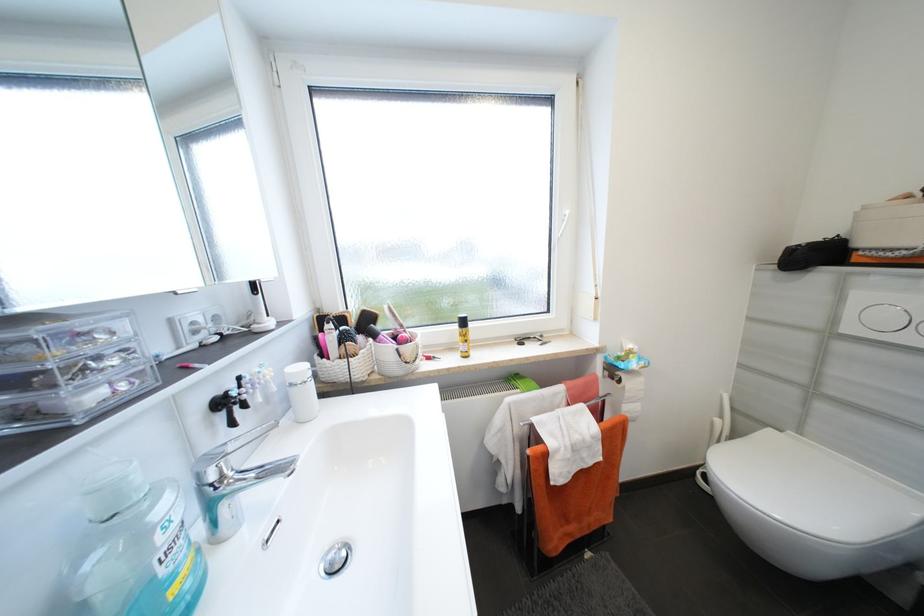
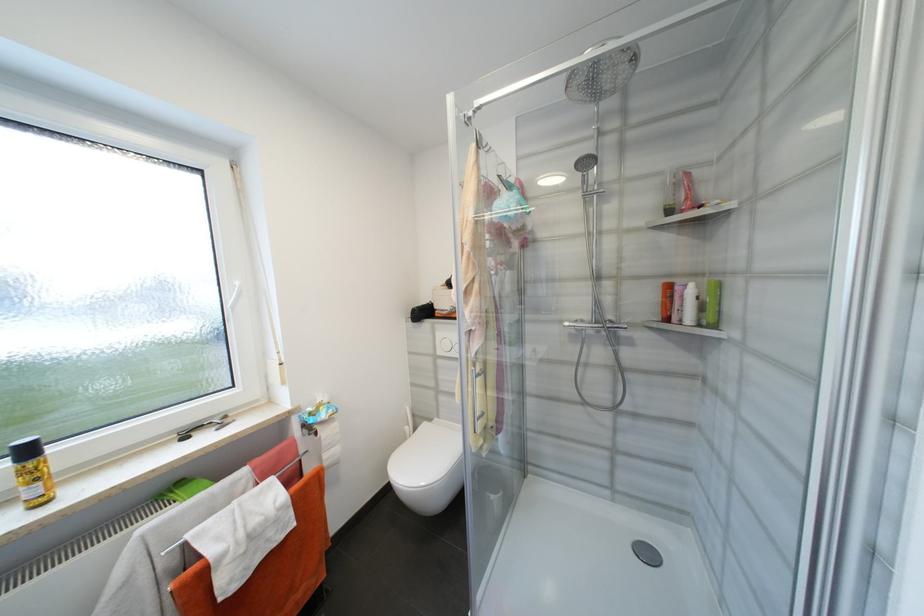
Where in the second image is the point corresponding to [573,214] from the first image?

(242, 285)